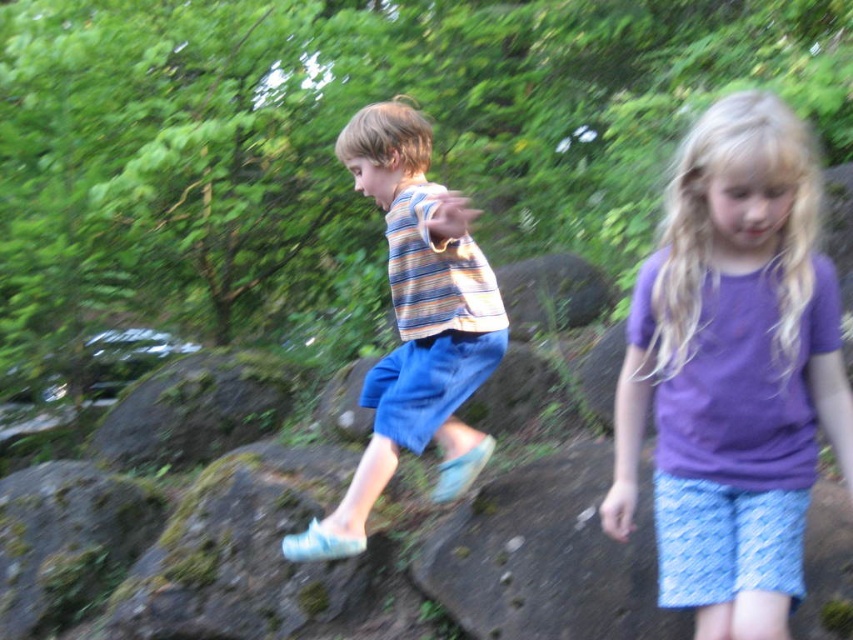
In the scene shown: You are a photographer trying to capture both the purple cotton shirt at center and the striped cotton shirt at center in a single shot. Based on their positions, which child should you focus on first to ensure both are in frame?

The purple cotton shirt at center is in front of the striped cotton shirt at center. To ensure both are in frame, focus on the striped cotton shirt at center first as it is further back, allowing the photographer to adjust the shot to include both.

You are a parent trying to decide where to place a small toy for your children to find. The green mossy rock at lower left and the green mossy rock at center are both options. Which rock would you choose if you want the toy to be more visible to the children?

The green mossy rock at center would be a better choice because it occupies more space than the green mossy rock at lower left, making it easier for the children to spot the toy.